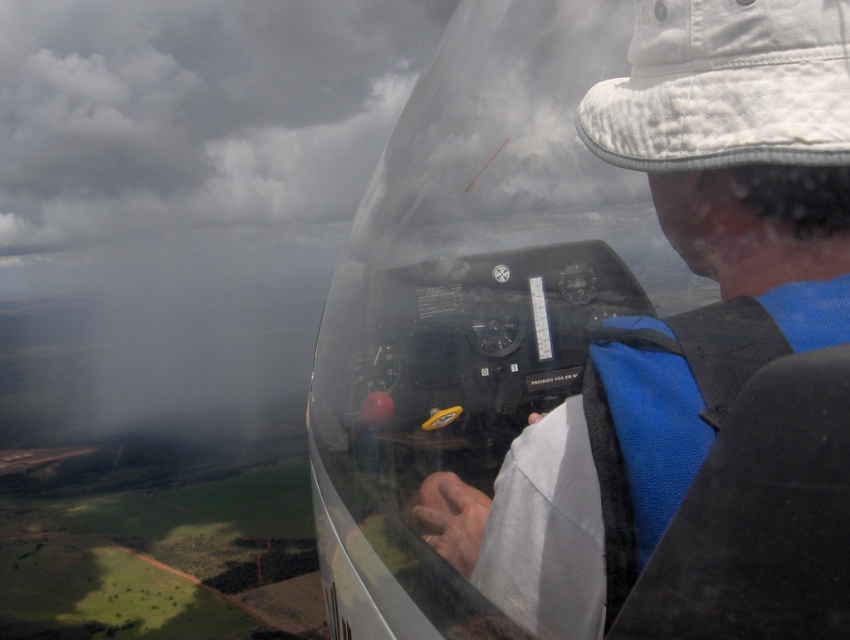
Is transparent plastic cockpit at center further to the viewer compared to white quilted fabric baseball hat at upper center?

No, it is in front of white quilted fabric baseball hat at upper center.

Between transparent plastic cockpit at center and white quilted fabric baseball hat at upper center, which one has more height?

With more height is transparent plastic cockpit at center.

Find the location of a particular element. The image size is (850, 640). transparent plastic cockpit at center is located at coordinates (586, 349).

Is transparent plastic cockpit at center shorter than cloudy gray sky at upper left?

Indeed, transparent plastic cockpit at center has a lesser height compared to cloudy gray sky at upper left.

Looking at this image, measure the distance from transparent plastic cockpit at center to cloudy gray sky at upper left.

The distance of transparent plastic cockpit at center from cloudy gray sky at upper left is 386.11 feet.

Which is behind, point (537, 369) or point (37, 72)?

The point (37, 72) is behind.

Find the location of a particular element. This screenshot has height=640, width=850. transparent plastic cockpit at center is located at coordinates (586, 349).

Can you confirm if cloudy gray sky at upper left is taller than white quilted fabric baseball hat at upper center?

Yes.

Measure the distance between cloudy gray sky at upper left and white quilted fabric baseball hat at upper center.

cloudy gray sky at upper left is 70.74 meters away from white quilted fabric baseball hat at upper center.

At what (x,y) coordinates should I click in order to perform the action: click on cloudy gray sky at upper left. Please return your answer as a coordinate pair (x, y). Image resolution: width=850 pixels, height=640 pixels. Looking at the image, I should click on (196, 112).